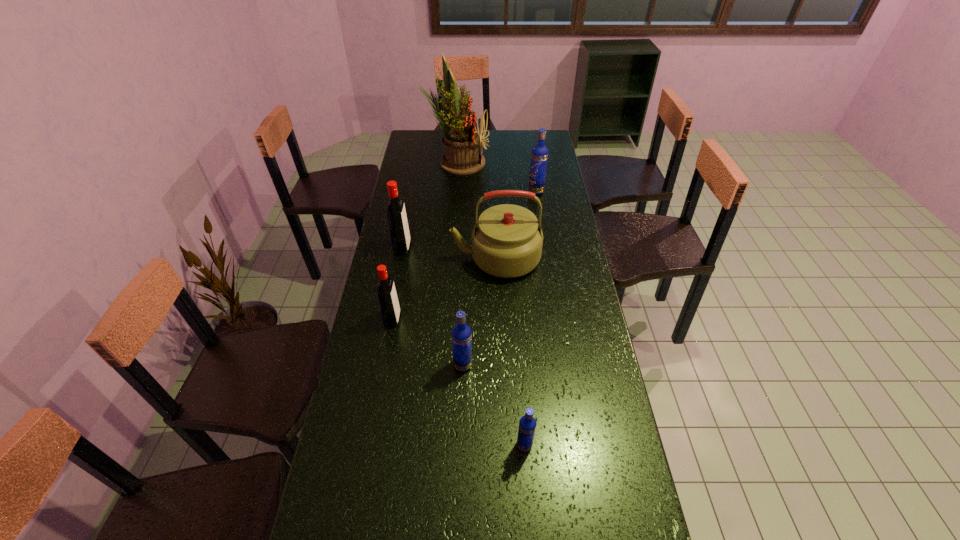
Locate an element on the screen. The image size is (960, 540). vacant space that satisfies the following two spatial constraints: 1. on the back side of the smallest blue vodka; 2. at the spout of the green kettle is located at coordinates (511, 258).

This screenshot has width=960, height=540. What are the coordinates of `vacant space that satisfies the following two spatial constraints: 1. on the front and back of the third nearest object; 2. on the back side of the smallest blue vodka` in the screenshot? It's located at (370, 445).